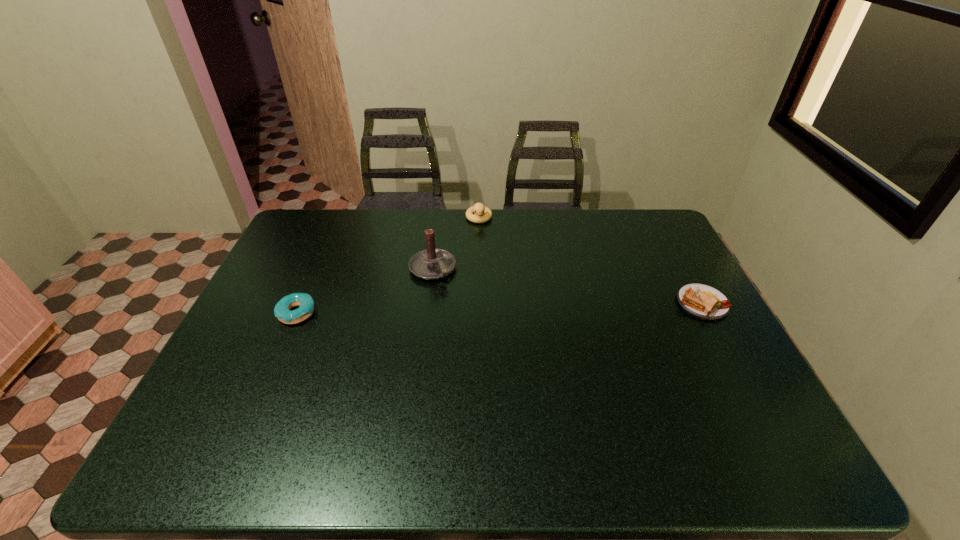
Where is `free region located 0.270m on the side of the third nearest object with the handle loop`? free region located 0.270m on the side of the third nearest object with the handle loop is located at coordinates (487, 342).

The width and height of the screenshot is (960, 540). Identify the location of vacant space located at the beak of the second tallest object. (480, 285).

The width and height of the screenshot is (960, 540). What are the coordinates of `free point located at the beak of the second tallest object` in the screenshot? It's located at (480, 260).

Identify the location of free space located at the beak of the second tallest object. (480, 294).

What are the coordinates of `object present at the far edge` in the screenshot? It's located at (478, 208).

Find the location of a particular element. This screenshot has width=960, height=540. object that is at the left edge is located at coordinates (282, 311).

You are a GUI agent. You are given a task and a screenshot of the screen. Output one action in this format:
    pyautogui.click(x=<x>, y=<y>)
    Task: Click on the object that is at the right edge
    
    Given the screenshot: What is the action you would take?
    pyautogui.click(x=702, y=301)

Where is `free space at the far edge`? free space at the far edge is located at coordinates (466, 245).

Where is `vacant point at the near edge`? vacant point at the near edge is located at coordinates (439, 397).

I want to click on vacant space at the left edge, so click(285, 332).